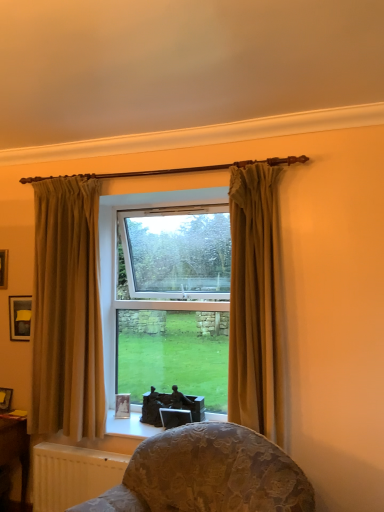
Question: Is wooden table at lower left taller than matte black picture frame at upper left, which is the fourth picture frame from right to left?

Choices:
 (A) no
 (B) yes

Answer: (B)

Question: Can you confirm if wooden table at lower left is positioned to the right of matte black picture frame at upper left, placed as the first picture frame when sorted from left to right?

Choices:
 (A) no
 (B) yes

Answer: (B)

Question: Is matte black picture frame at upper left, placed as the first picture frame when sorted from left to right, completely or partially inside wooden table at lower left?

Choices:
 (A) no
 (B) yes

Answer: (A)

Question: Does wooden table at lower left have a larger size compared to matte black picture frame at upper left, acting as the first picture frame starting from the top?

Choices:
 (A) no
 (B) yes

Answer: (B)

Question: Can you confirm if wooden table at lower left is thinner than matte black picture frame at upper left, acting as the first picture frame starting from the top?

Choices:
 (A) no
 (B) yes

Answer: (A)

Question: Is wooden table at lower left not inside matte black picture frame at upper left, acting as the first picture frame starting from the top?

Choices:
 (A) no
 (B) yes

Answer: (B)

Question: Does matte silver picture frame at lower center, placed as the 1th picture frame when sorted from bottom to top, lie behind wooden table at lower left?

Choices:
 (A) yes
 (B) no

Answer: (A)

Question: From a real-world perspective, does matte silver picture frame at lower center, placed as the 1th picture frame when sorted from bottom to top, sit lower than wooden table at lower left?

Choices:
 (A) no
 (B) yes

Answer: (A)

Question: Can you confirm if matte silver picture frame at lower center, placed as the 1th picture frame when sorted from bottom to top, is wider than wooden table at lower left?

Choices:
 (A) yes
 (B) no

Answer: (B)

Question: Does matte silver picture frame at lower center, which is counted as the first picture frame, starting from the right, have a smaller size compared to wooden table at lower left?

Choices:
 (A) yes
 (B) no

Answer: (A)

Question: Considering the relative positions of matte silver picture frame at lower center, placed as the 1th picture frame when sorted from bottom to top, and wooden table at lower left in the image provided, is matte silver picture frame at lower center, placed as the 1th picture frame when sorted from bottom to top, to the left of wooden table at lower left from the viewer's perspective?

Choices:
 (A) yes
 (B) no

Answer: (B)

Question: Is wooden table at lower left a part of matte silver picture frame at lower center, the fourth picture frame positioned from the top?

Choices:
 (A) no
 (B) yes

Answer: (A)

Question: Is matte beige curtain at left, which is counted as the second curtain, starting from the right, to the left of white textured radiator at lower left from the viewer's perspective?

Choices:
 (A) yes
 (B) no

Answer: (A)